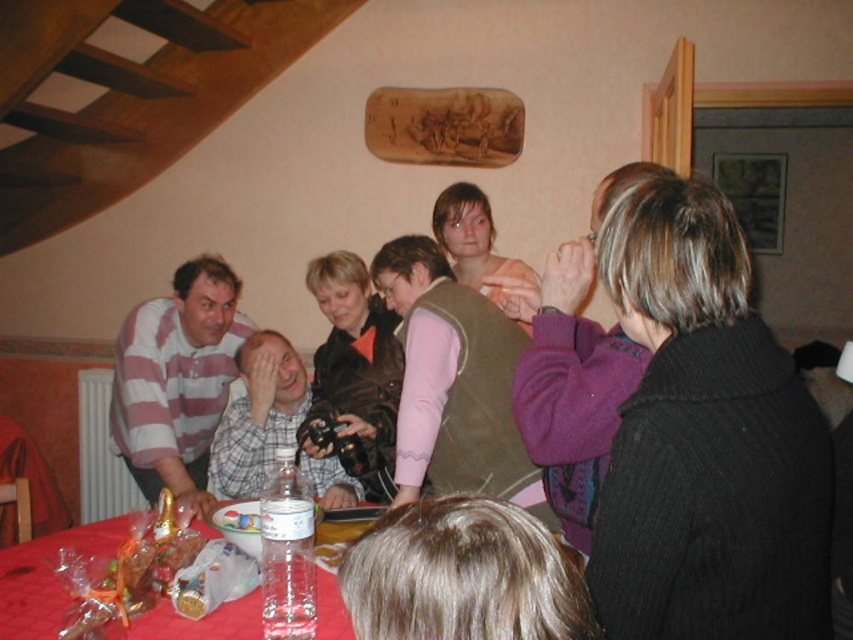
Question: Can you confirm if striped cotton shirt at left is positioned below translucent plastic table at lower center?

Choices:
 (A) yes
 (B) no

Answer: (B)

Question: From the image, what is the correct spatial relationship of matte black camera at center in relation to black knitted sweater at upper right?

Choices:
 (A) left
 (B) right

Answer: (A)

Question: Which point is closer to the camera?

Choices:
 (A) matte black camera at center
 (B) translucent plastic table at lower center
 (C) black knitted sweater at upper right
 (D) striped cotton shirt at left

Answer: (C)

Question: Which point is farther from the camera taking this photo?

Choices:
 (A) (611, 449)
 (B) (47, 609)
 (C) (151, 493)
 (D) (689, 356)

Answer: (C)

Question: Does striped cotton shirt at left have a lesser width compared to translucent plastic table at lower center?

Choices:
 (A) yes
 (B) no

Answer: (A)

Question: Estimate the real-world distances between objects in this image. Which object is farther from the matte black camera at center?

Choices:
 (A) translucent plastic table at lower center
 (B) black knitted sweater at upper right

Answer: (A)